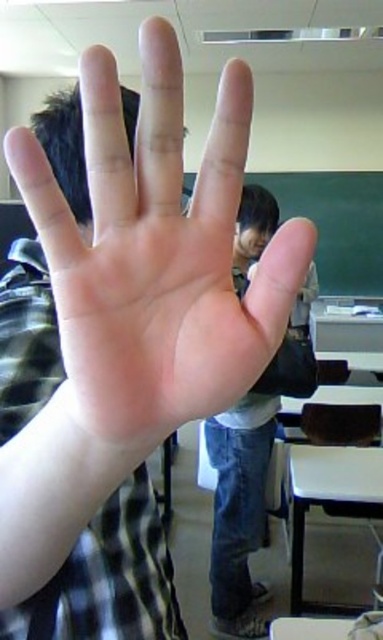
You are a photographer in a classroom. You notice two objects at the center of the image, the smooth skin palm at center and the jeans at center. Which one is more to the left?

The smooth skin palm at center is positioned on the left side of jeans at center, so it is more to the left.

You are a photographer adjusting your camera settings. You notice the smooth skin palm at center and jeans at center in your viewfinder. Which object appears narrower in the frame?

The smooth skin palm at center appears narrower than the jeans at center because it has a lesser width compared to the jeans at center.